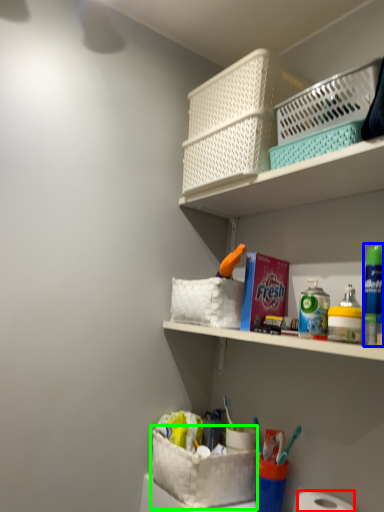
Question: Considering the real-world distances, which object is closest to toilet paper (highlighted by a red box)? mouthwash (highlighted by a blue box) or basket container (highlighted by a green box).

Choices:
 (A) mouthwash
 (B) basket container

Answer: (B)